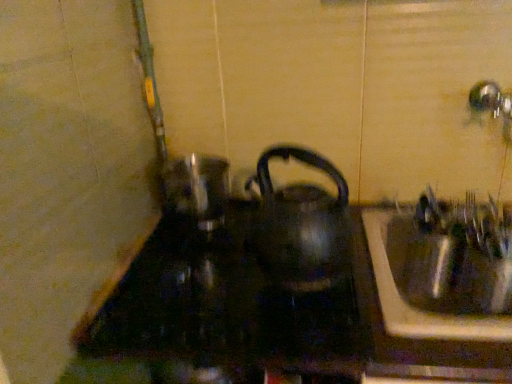
Question: From a real-world perspective, is metallic sink at right positioned under black glossy kettle at center based on gravity?

Choices:
 (A) yes
 (B) no

Answer: (A)

Question: Considering the relative sizes of metallic sink at right and black glossy kettle at center in the image provided, is metallic sink at right taller than black glossy kettle at center?

Choices:
 (A) yes
 (B) no

Answer: (B)

Question: Is metallic sink at right in contact with black glossy kettle at center?

Choices:
 (A) yes
 (B) no

Answer: (B)

Question: Are metallic sink at right and black glossy kettle at center far apart?

Choices:
 (A) yes
 (B) no

Answer: (B)

Question: From a real-world perspective, is metallic sink at right on black glossy kettle at center?

Choices:
 (A) no
 (B) yes

Answer: (A)

Question: Considering the relative positions of metallic sink at right and black glossy kettle at center in the image provided, is metallic sink at right in front of black glossy kettle at center?

Choices:
 (A) yes
 (B) no

Answer: (B)

Question: Is the position of black glossy kettle at center less distant than that of black glass stove at center?

Choices:
 (A) yes
 (B) no

Answer: (B)

Question: From the image's perspective, is black glossy kettle at center under black glass stove at center?

Choices:
 (A) yes
 (B) no

Answer: (B)

Question: Considering the relative positions of black glossy kettle at center and black glass stove at center in the image provided, is black glossy kettle at center to the left of black glass stove at center from the viewer's perspective?

Choices:
 (A) no
 (B) yes

Answer: (A)

Question: Does black glossy kettle at center come behind black glass stove at center?

Choices:
 (A) yes
 (B) no

Answer: (A)

Question: Considering the relative sizes of black glossy kettle at center and black glass stove at center in the image provided, is black glossy kettle at center wider than black glass stove at center?

Choices:
 (A) yes
 (B) no

Answer: (B)

Question: Does black glossy kettle at center touch black glass stove at center?

Choices:
 (A) no
 (B) yes

Answer: (A)

Question: Does black glass stove at center have a lesser width compared to black glossy kettle at center?

Choices:
 (A) no
 (B) yes

Answer: (A)